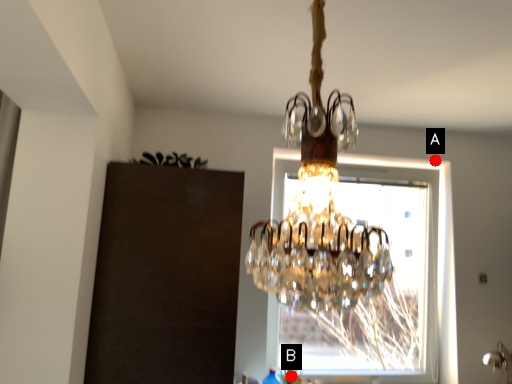
Question: Two points are circled on the image, labeled by A and B beside each circle. Which of the following is the farthest from the observer?

Choices:
 (A) A is further
 (B) B is further

Answer: (A)